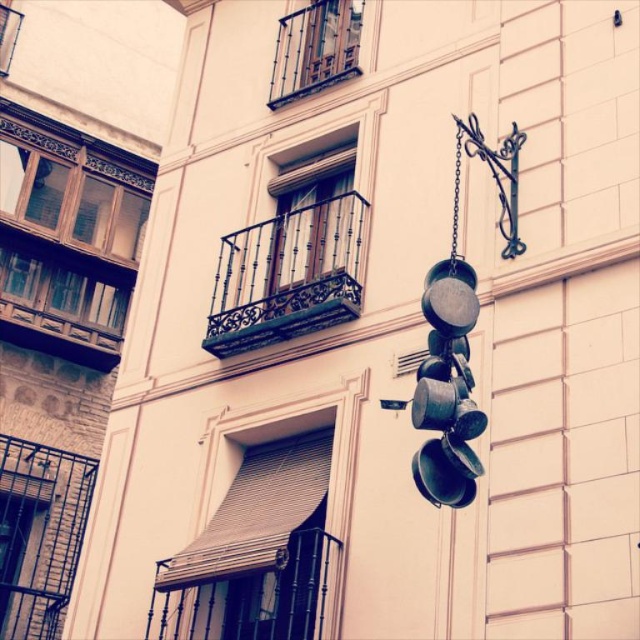
You are an architect analyzing the building facade. Which object, the green matte pans at right or the polished metal balcony at upper center, would require more materials to construct due to its size?

The green matte pans at right requires more materials to construct because it has a larger size compared to the polished metal balcony at upper center.

You are standing in front of the building with the soft pastel pink facade. You notice a point marked at coordinates (288,275). Can you determine which architectural feature this point is located on?

The point at coordinates (288,275) is located on the dark brown wrought iron balcony at center.